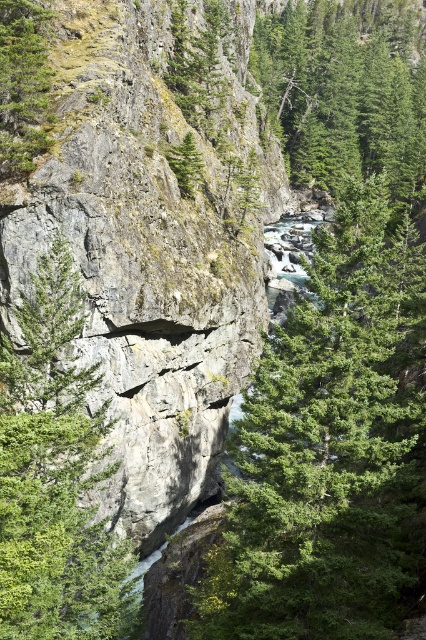
You are a hiker trying to cross the canyon. You see a green leafy tree at center and a green rough tree at center. Which tree is closer to the cliff on the left side of the frame?

The green rough tree at center is closer to the cliff on the left side of the frame because it is positioned closer to the cliff compared to the green leafy tree at center.

You are a hiker trying to cross the canyon. You see a green leafy tree at center and a green rough tree at center. Which tree would block your view of the other tree?

The green leafy tree at center is in front of the green rough tree at center, so it would block the view of the green rough tree at center.